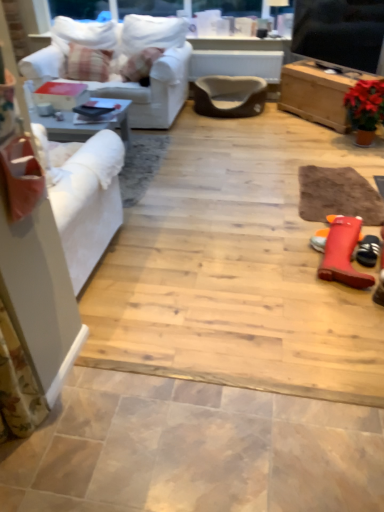
This screenshot has width=384, height=512. What do you see at coordinates (343, 252) in the screenshot?
I see `rubber boot at lower right, the 1th footwear when ordered from left to right` at bounding box center [343, 252].

Locate an element on the screen. The image size is (384, 512). natural stone tile at lower left, the first ceramic tile when ordered from top to bottom is located at coordinates (236, 268).

Locate an element on the screen. This screenshot has height=512, width=384. wooden chest at upper right, placed as the 2th table when sorted from left to right is located at coordinates (317, 93).

Find the location of a particular element. The width and height of the screenshot is (384, 512). rubber boot at lower right, the 1th footwear when ordered from left to right is located at coordinates (343, 252).

Considering the sizes of brown suede armchair at center and wooden chest at upper right, which is the first table in right-to-left order, in the image, is brown suede armchair at center taller or shorter than wooden chest at upper right, which is the first table in right-to-left order,?

Clearly, brown suede armchair at center is shorter compared to wooden chest at upper right, which is the first table in right-to-left order.

From the image's perspective, which is below, brown suede armchair at center or wooden chest at upper right, placed as the 2th table when sorted from left to right?

wooden chest at upper right, placed as the 2th table when sorted from left to right, from the image's perspective.

Considering the sizes of brown suede armchair at center and wooden chest at upper right, which is the first table in right-to-left order, in the image, is brown suede armchair at center wider or thinner than wooden chest at upper right, which is the first table in right-to-left order,?

brown suede armchair at center is wider than wooden chest at upper right, which is the first table in right-to-left order.

Is brown suede armchair at center oriented away from wooden chest at upper right, which is the first table in right-to-left order?

No, brown suede armchair at center is not facing the opposite direction of wooden chest at upper right, which is the first table in right-to-left order.

Is brown fabric pet bed at center, the first table from the left, situated inside matte ceramic tile at lower center, the first ceramic tile when ordered from front to back, or outside?

brown fabric pet bed at center, the first table from the left, cannot be found inside matte ceramic tile at lower center, the first ceramic tile when ordered from front to back.

Is brown fabric pet bed at center, acting as the second table starting from the right, taller or shorter than matte ceramic tile at lower center, the first ceramic tile when ordered from front to back?

In the image, brown fabric pet bed at center, acting as the second table starting from the right, appears to be taller than matte ceramic tile at lower center, the first ceramic tile when ordered from front to back.

From the image's perspective, which table is the 2nd one above the matte ceramic tile at lower center, arranged as the second ceramic tile when viewed from the back? Please provide its 2D coordinates.

[(236, 64)]

Which object is positioned more to the right, brown fabric pet bed at center, the first table from the left, or matte ceramic tile at lower center, the first ceramic tile when ordered from front to back?

brown fabric pet bed at center, the first table from the left, is more to the right.

Does point (334, 13) lie in front of point (173, 39)?

Yes, it is in front of point (173, 39).

Does black glossy tv at upper right come in front of white fabric couch at upper left?

That is True.

Is black glossy tv at upper right bigger than white fabric couch at upper left?

No.

There is a white fabric couch at upper left. Where is `window screen above it (from a real-world perspective)`? The height and width of the screenshot is (512, 384). window screen above it (from a real-world perspective) is located at coordinates (340, 32).

Is natural stone tile at lower left, which ranks as the second ceramic tile in bottom-to-top order, completely or partially inside rubber black shoe at lower right, the first footwear viewed from the right?

No, natural stone tile at lower left, which ranks as the second ceramic tile in bottom-to-top order, is located outside of rubber black shoe at lower right, the first footwear viewed from the right.

From a real-world perspective, is rubber black shoe at lower right, the first footwear viewed from the right, positioned above or below natural stone tile at lower left, the first ceramic tile when ordered from top to bottom?

Clearly, from a real-world perspective, rubber black shoe at lower right, the first footwear viewed from the right, is above natural stone tile at lower left, the first ceramic tile when ordered from top to bottom.

Looking at this image, between rubber black shoe at lower right, marked as the second footwear in a left-to-right arrangement, and natural stone tile at lower left, the first ceramic tile when ordered from back to front, which one appears on the right side from the viewer's perspective?

From the viewer's perspective, rubber black shoe at lower right, marked as the second footwear in a left-to-right arrangement, appears more on the right side.

Considering the relative sizes of plaid fabric pillow at upper left and matte ceramic tile at lower center, arranged as the second ceramic tile when viewed from the back, in the image provided, is plaid fabric pillow at upper left wider than matte ceramic tile at lower center, arranged as the second ceramic tile when viewed from the back,?

No, plaid fabric pillow at upper left is not wider than matte ceramic tile at lower center, arranged as the second ceramic tile when viewed from the back.

Considering the relative sizes of plaid fabric pillow at upper left and matte ceramic tile at lower center, the 1th ceramic tile from the bottom, in the image provided, is plaid fabric pillow at upper left bigger than matte ceramic tile at lower center, the 1th ceramic tile from the bottom,?

Yes.

Which object is more forward, plaid fabric pillow at upper left or matte ceramic tile at lower center, the 1th ceramic tile from the bottom?

matte ceramic tile at lower center, the 1th ceramic tile from the bottom, is in front.

Does point (372, 57) appear closer or farther from the camera than point (346, 131)?

Point (372, 57) is positioned closer to the camera compared to point (346, 131).

What's the angular difference between black glossy tv at upper right and wooden chest at upper right, which is the first table in right-to-left order,'s facing directions?

black glossy tv at upper right and wooden chest at upper right, which is the first table in right-to-left order, are facing 0.54 degrees away from each other.

Based on their positions, is black glossy tv at upper right located to the left or right of wooden chest at upper right, which is the first table in right-to-left order?

Based on their positions, black glossy tv at upper right is located to the left of wooden chest at upper right, which is the first table in right-to-left order.

Considering the relative sizes of black glossy tv at upper right and wooden chest at upper right, placed as the 2th table when sorted from left to right, in the image provided, is black glossy tv at upper right smaller than wooden chest at upper right, placed as the 2th table when sorted from left to right,?

Yes.

Based on the photo, is the position of brown suede armchair at center more distant than that of rubber black shoe at lower right, the first footwear viewed from the right?

Yes, brown suede armchair at center is further from the camera.

From a real-world perspective, is brown suede armchair at center positioned above or below rubber black shoe at lower right, marked as the second footwear in a left-to-right arrangement?

From a real-world perspective, brown suede armchair at center is physically above rubber black shoe at lower right, marked as the second footwear in a left-to-right arrangement.

Is brown suede armchair at center completely or partially outside of rubber black shoe at lower right, marked as the second footwear in a left-to-right arrangement?

Yes, brown suede armchair at center is located beyond the bounds of rubber black shoe at lower right, marked as the second footwear in a left-to-right arrangement.

Is point (256, 96) closer or farther from the camera than point (369, 242)?

Clearly, point (256, 96) is more distant from the camera than point (369, 242).

Locate an element on the screen. armchair on the left of wooden chest at upper right, placed as the 2th table when sorted from left to right is located at coordinates (229, 96).

Find the location of a particular element. table that is the 1st object to the right of the matte ceramic tile at lower center, the 1th ceramic tile from the bottom, starting at the anchor is located at coordinates (236, 64).

From the image, which object appears to be farther from rubber boot at lower right, the 2th footwear positioned from the right, white fabric couch at upper left or brown fabric pet bed at center, the first table from the left?

brown fabric pet bed at center, the first table from the left.

From the image, which object appears to be farther from matte ceramic tile at lower center, the 1th ceramic tile from the bottom, black glossy tv at upper right or wooden chest at upper right, which is the first table in right-to-left order?

The object further to matte ceramic tile at lower center, the 1th ceramic tile from the bottom, is black glossy tv at upper right.

Considering their positions, is natural stone tile at lower left, the first ceramic tile when ordered from back to front, positioned closer to matte ceramic tile at lower center, arranged as the second ceramic tile when viewed from the back, than brown fabric pet bed at center, the first table from the left?

natural stone tile at lower left, the first ceramic tile when ordered from back to front, is positioned closer to the anchor matte ceramic tile at lower center, arranged as the second ceramic tile when viewed from the back.

Looking at the image, which one is located closer to rubber boot at lower right, the 2th footwear positioned from the right, brown suede armchair at center or wooden chest at upper right, placed as the 2th table when sorted from left to right?

wooden chest at upper right, placed as the 2th table when sorted from left to right, is positioned closer to the anchor rubber boot at lower right, the 2th footwear positioned from the right.

Which object lies nearer to the anchor point rubber boot at lower right, the 1th footwear when ordered from left to right, rubber black shoe at lower right, the first footwear viewed from the right, or plaid fabric pillow at upper left?

rubber black shoe at lower right, the first footwear viewed from the right, lies closer to rubber boot at lower right, the 1th footwear when ordered from left to right, than the other object.

Based on their spatial positions, is brown fabric pet bed at center, the first table from the left, or matte ceramic tile at lower center, the first ceramic tile when ordered from front to back, further from white fabric couch at upper left?

Among the two, matte ceramic tile at lower center, the first ceramic tile when ordered from front to back, is located further to white fabric couch at upper left.

Based on their spatial positions, is plaid fabric pillow at upper left or rubber boot at lower right, the 1th footwear when ordered from left to right, further from white fabric couch at upper left?

Based on the image, rubber boot at lower right, the 1th footwear when ordered from left to right, appears to be further to white fabric couch at upper left.

When comparing their distances from plaid fabric pillow at upper left, does rubber black shoe at lower right, marked as the second footwear in a left-to-right arrangement, or matte ceramic tile at lower center, acting as the second ceramic tile starting from the top, seem further?

Based on the image, matte ceramic tile at lower center, acting as the second ceramic tile starting from the top, appears to be further to plaid fabric pillow at upper left.

Locate an element on the screen. The height and width of the screenshot is (512, 384). armchair positioned between natural stone tile at lower left, which ranks as the second ceramic tile in bottom-to-top order, and brown fabric pet bed at center, the first table from the left, from near to far is located at coordinates (229, 96).

Where is `armchair located between white fabric couch at upper left and wooden chest at upper right, which is the first table in right-to-left order, in the left-right direction`? This screenshot has width=384, height=512. armchair located between white fabric couch at upper left and wooden chest at upper right, which is the first table in right-to-left order, in the left-right direction is located at coordinates (229, 96).

Image resolution: width=384 pixels, height=512 pixels. I want to click on armchair between rubber black shoe at lower right, the first footwear viewed from the right, and brown fabric pet bed at center, acting as the second table starting from the right, along the z-axis, so click(x=229, y=96).

Image resolution: width=384 pixels, height=512 pixels. I want to click on ceramic tile between matte ceramic tile at lower center, the 1th ceramic tile from the bottom, and plaid fabric pillow at upper left from front to back, so click(x=236, y=268).